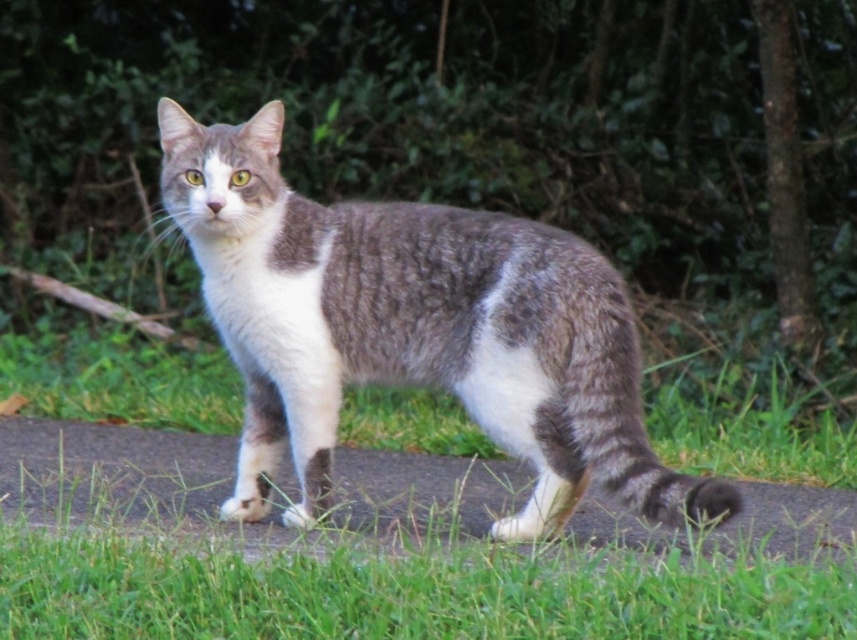
Does gray tabby cat at center have a lesser width compared to gray asphalt at center?

Yes.

Describe the element at coordinates (412, 330) in the screenshot. I see `gray tabby cat at center` at that location.

Where is `gray tabby cat at center`? gray tabby cat at center is located at coordinates (412, 330).

Does gray tabby cat at center appear on the left side of gray striped tail at lower right?

Indeed, gray tabby cat at center is positioned on the left side of gray striped tail at lower right.

Can you confirm if gray tabby cat at center is thinner than gray striped tail at lower right?

Incorrect, gray tabby cat at center's width is not less than gray striped tail at lower right's.

Identify the location of gray tabby cat at center. This screenshot has width=857, height=640. (412, 330).

Does gray asphalt at center have a greater width compared to gray striped tail at lower right?

Yes.

Can you confirm if gray asphalt at center is smaller than gray striped tail at lower right?

Actually, gray asphalt at center might be larger than gray striped tail at lower right.

Is point (183, 444) positioned before point (604, 422)?

That is False.

I want to click on gray asphalt at center, so click(231, 484).